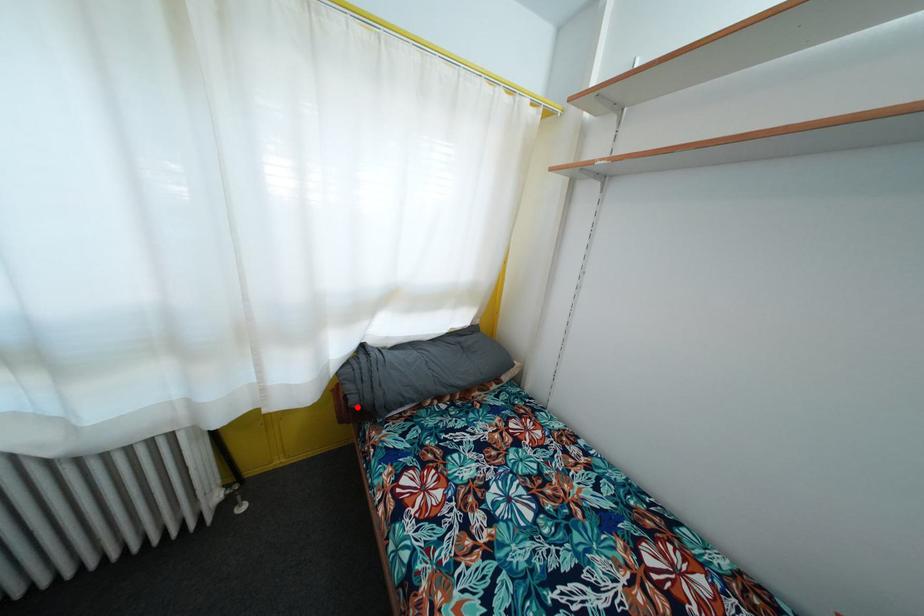
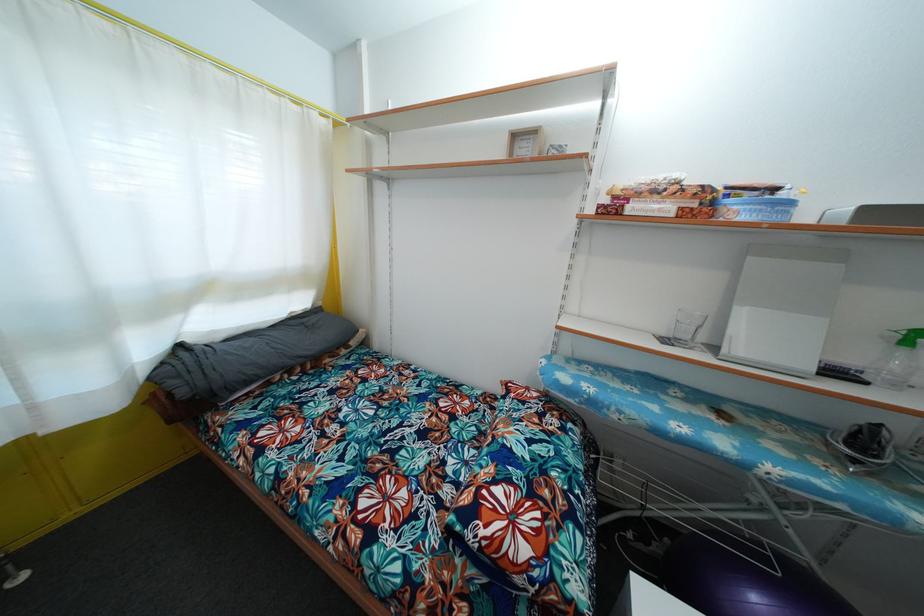
Question: I am providing you with two images of the same scene from different viewpoints. A red point is shown in image1. For the corresponding object point in image2, is it positioned nearer or farther from the camera?

Choices:
 (A) Nearer
 (B) Farther

Answer: (A)